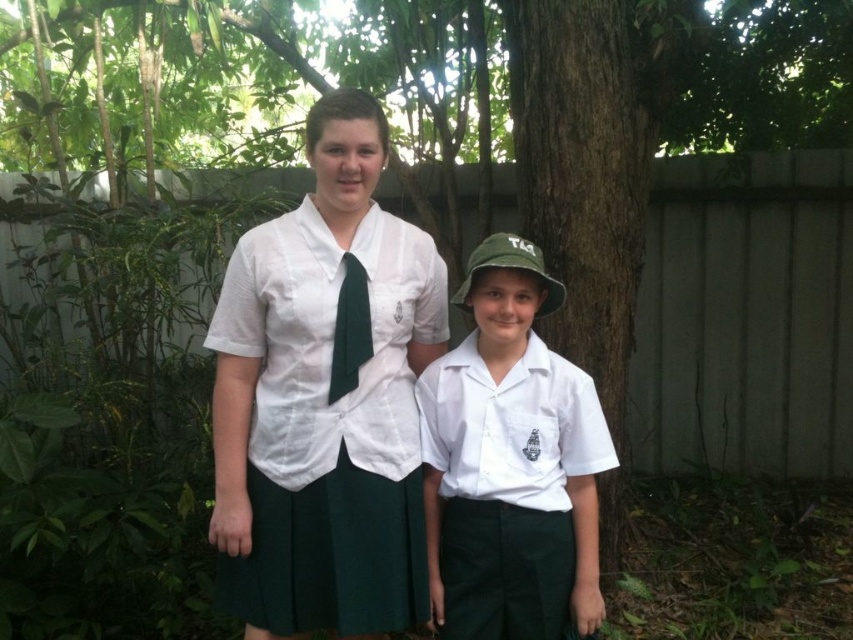
You are designing a layout for a photo album page and want to arrange the matte white blouse at center and the green silk tie at center based on their heights. Which object should you place higher on the page?

The matte white blouse at center is taller than the green silk tie at center, so you should place the matte white blouse at center higher on the page.

You are designing a clothing catalog and need to know which item takes up more horizontal space when displayed side by side. Based on the scene, which object has a greater width between the matte white blouse at center and the green silk tie at center?

The matte white blouse at center has a greater width than the green silk tie at center according to the description.